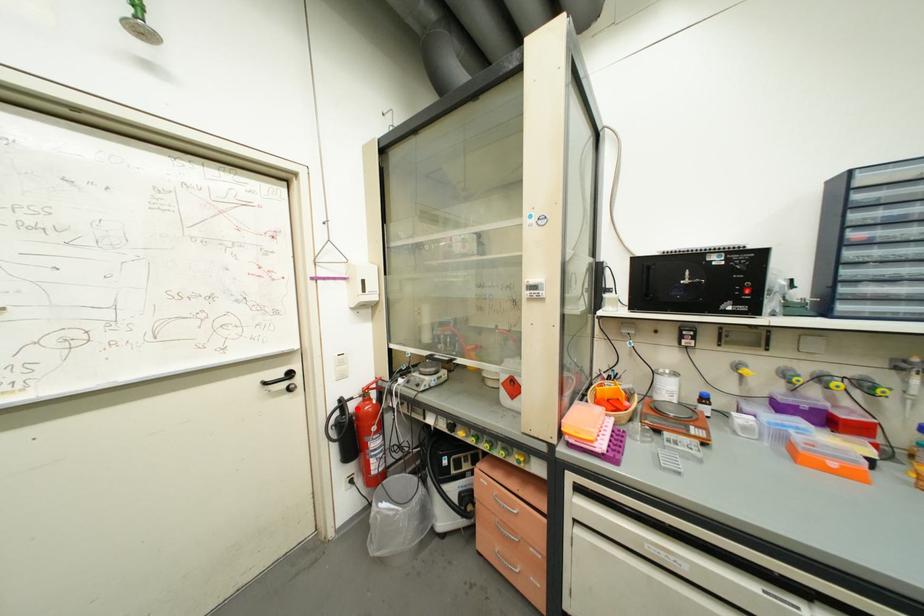
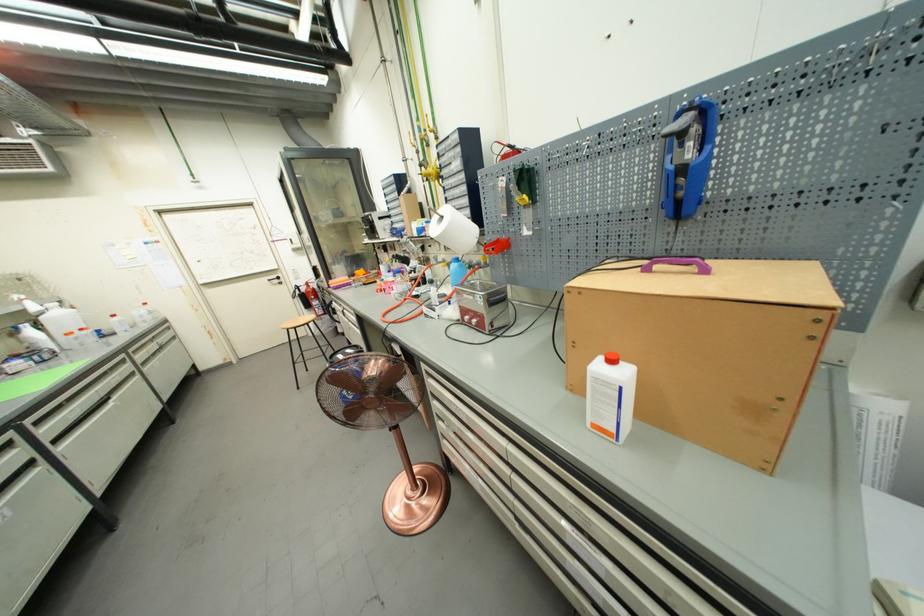
Where in the second image is the point corresponding to the highlighted location from the first image?

(309, 291)